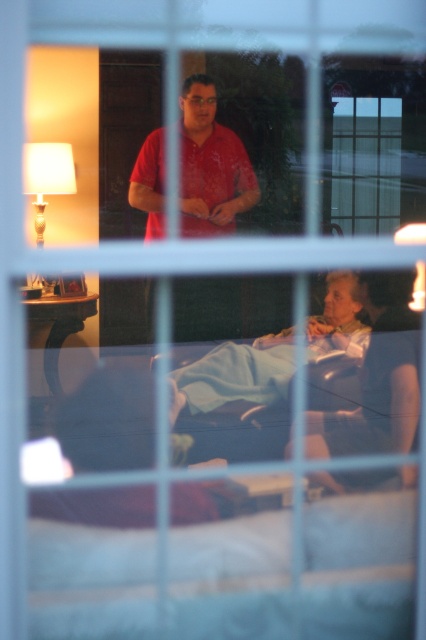
In the scene shown: You are standing outside the house looking through the window. You want to reach the light blue fabric at lower right with a 6.5 feet long pole. Can you just barely reach it?

The light blue fabric at lower right is 6.77 feet away from the camera. Since the pole is only 6.5 feet long, it is just slightly too short to reach it.